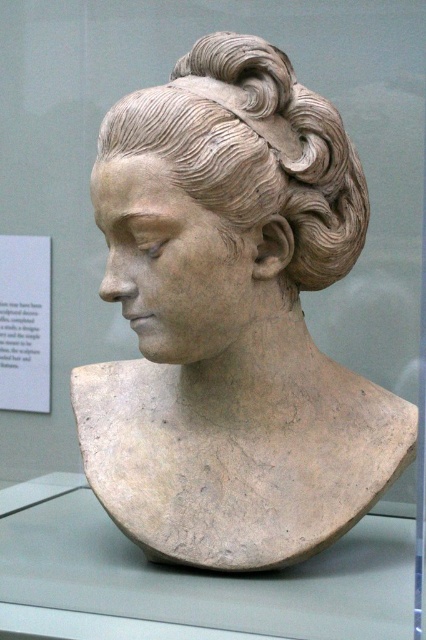
How distant is matte clay bust at center from matte clay hair bun at center?

The distance of matte clay bust at center from matte clay hair bun at center is 2.59 inches.

This screenshot has height=640, width=426. What do you see at coordinates (230, 320) in the screenshot?
I see `matte clay bust at center` at bounding box center [230, 320].

Which is in front, point (172, 358) or point (198, 192)?

Positioned in front is point (198, 192).

I want to click on matte clay bust at center, so click(230, 320).